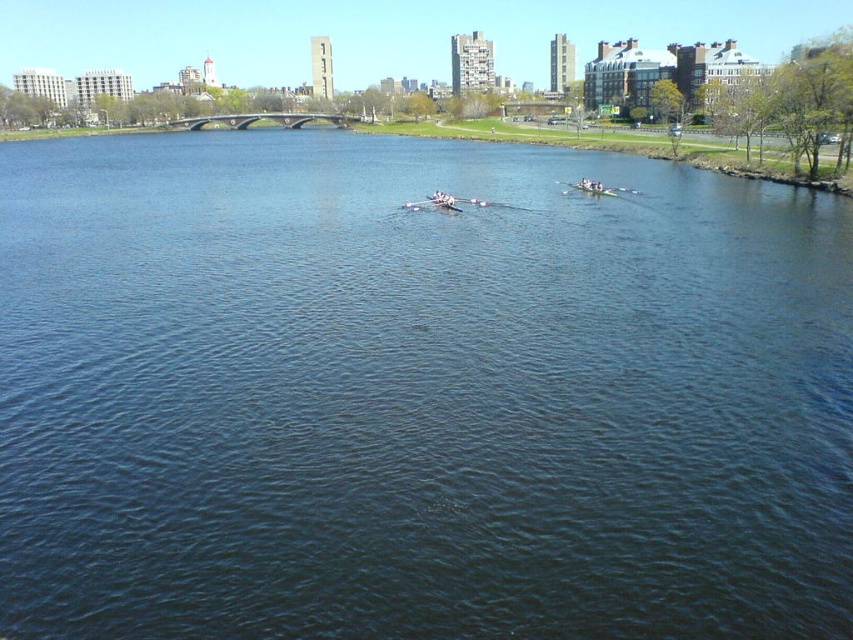
You are standing at the point with coordinates point (592, 188) in the image. What object is located at that point?

The point (592, 188) corresponds to the white glossy canoe at center.

You are a photographer planning to take a photo of the white glossy canoe at center and the smooth white oar at center from the riverside bank. Since you want to capture both objects in the frame, which object will appear taller in the photo?

The white glossy canoe at center will appear taller in the photo because it has a greater height compared to the smooth white oar at center.